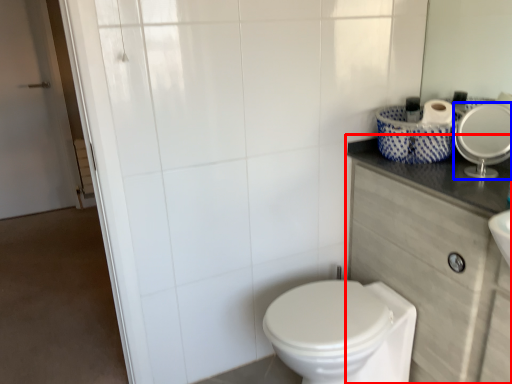
Question: Which point is closer to the camera, counter top (highlighted by a red box) or mirror (highlighted by a blue box)?

Choices:
 (A) counter top
 (B) mirror

Answer: (A)